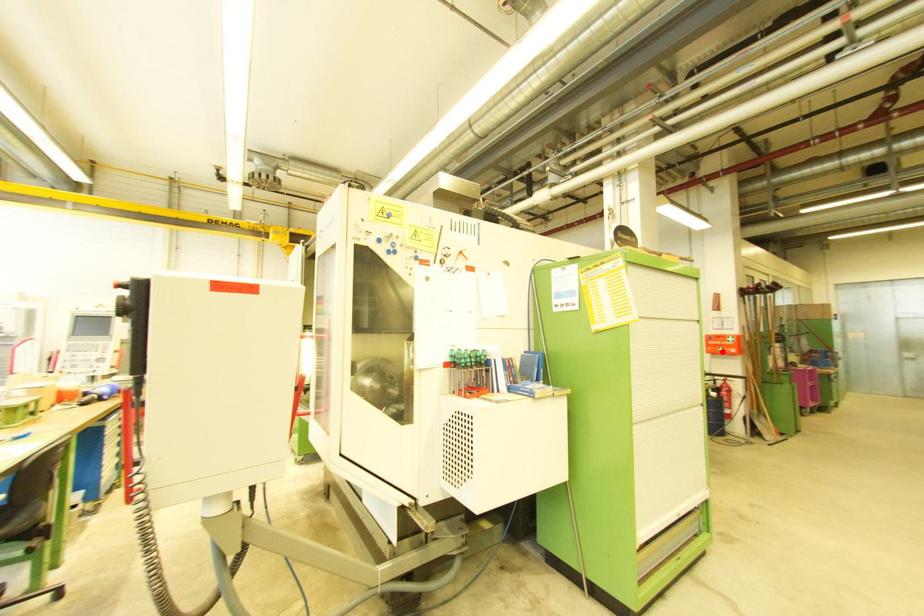
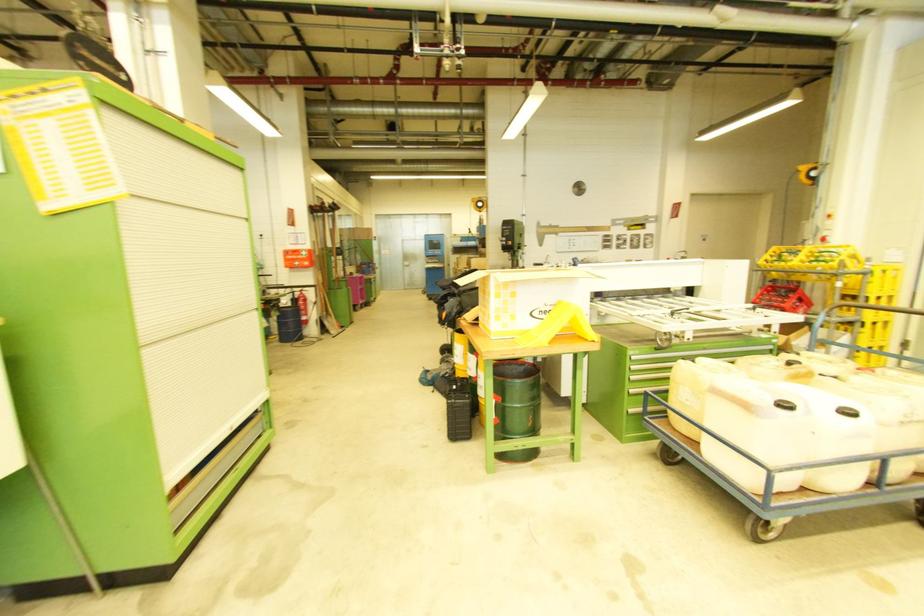
Question: I am providing you with two images of the same scene from different viewpoints. Given a red point in image1, look at the same physical point in image2. Is it:

Choices:
 (A) Closer to the viewpoint
 (B) Farther from the viewpoint

Answer: (A)